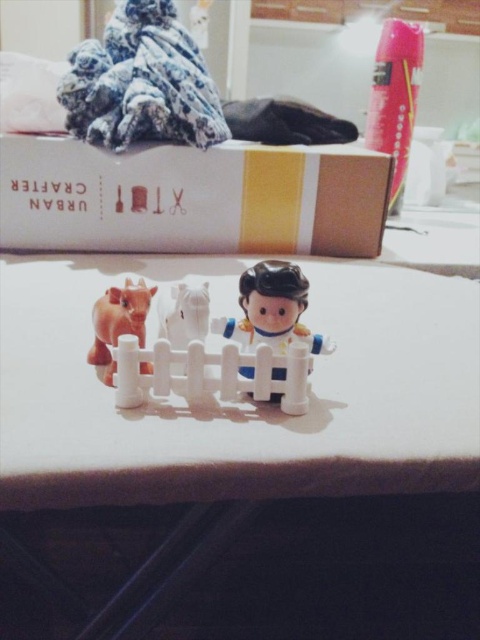
Is point (192, 371) positioned before point (99, 364)?

Yes, point (192, 371) is in front of point (99, 364).

Does white plastic fence at center appear on the right side of matte brown cow at left?

Correct, you'll find white plastic fence at center to the right of matte brown cow at left.

Image resolution: width=480 pixels, height=640 pixels. Describe the element at coordinates (214, 337) in the screenshot. I see `white plastic fence at center` at that location.

In order to click on white plastic fence at center in this screenshot , I will do `click(214, 337)`.

Is white plastic table at center smaller than white plastic fence at center?

Incorrect, white plastic table at center is not smaller in size than white plastic fence at center.

Who is positioned more to the left, white plastic table at center or white plastic fence at center?

Positioned to the left is white plastic fence at center.

Locate an element on the screen. The width and height of the screenshot is (480, 640). white plastic table at center is located at coordinates (248, 461).

Where is `white plastic table at center`? The width and height of the screenshot is (480, 640). white plastic table at center is located at coordinates (248, 461).

Between white plastic fence at center and fluffy fabric at upper left, which one appears on the right side from the viewer's perspective?

From the viewer's perspective, white plastic fence at center appears more on the right side.

Is white plastic fence at center positioned behind fluffy fabric at upper left?

No, it is not.

Who is more forward, (253, 364) or (141, 45)?

Point (253, 364) is more forward.

Locate an element on the screen. Image resolution: width=480 pixels, height=640 pixels. white plastic fence at center is located at coordinates (214, 337).